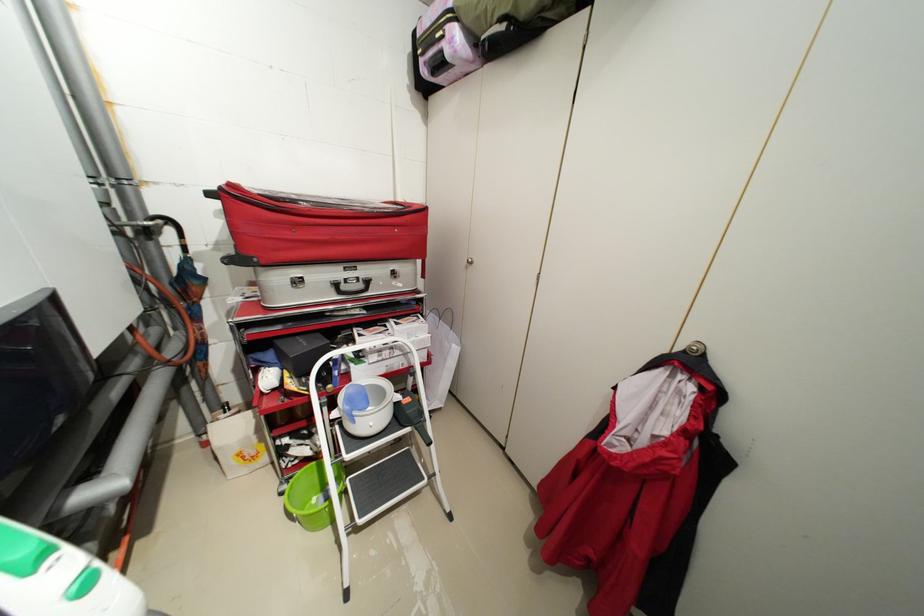
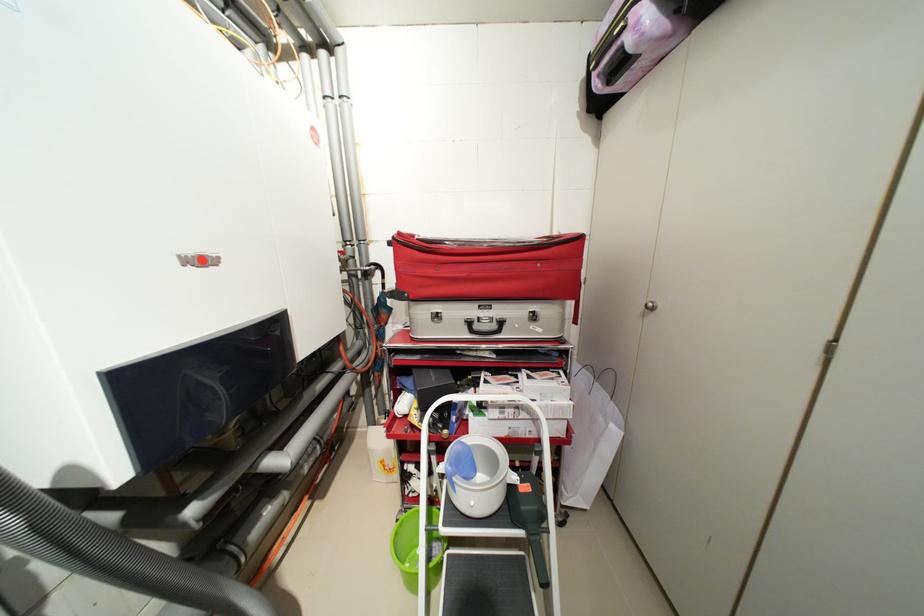
Where in the second image is the point corresponding to [412,355] from the first image?

(541, 421)